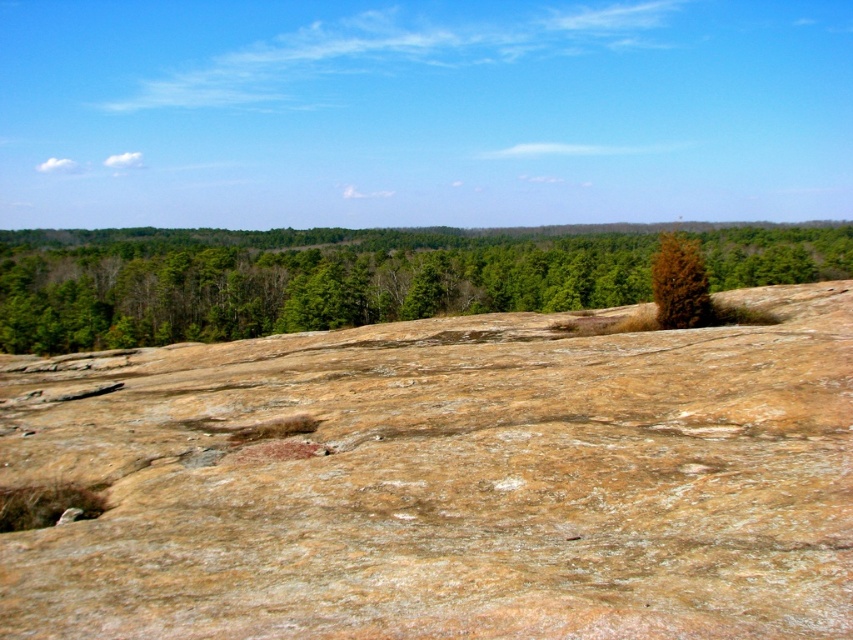
Can you confirm if brown rough rock at center is thinner than green leafy tree at center?

Yes.

Describe the element at coordinates (447, 481) in the screenshot. The height and width of the screenshot is (640, 853). I see `brown rough rock at center` at that location.

Where is `brown rough rock at center`? brown rough rock at center is located at coordinates (447, 481).

Can you confirm if brown rough rock at center is wider than brown textured tree at upper right?

Indeed, brown rough rock at center has a greater width compared to brown textured tree at upper right.

Can you confirm if brown rough rock at center is taller than brown textured tree at upper right?

Yes, brown rough rock at center is taller than brown textured tree at upper right.

Find the location of `brown rough rock at center`. brown rough rock at center is located at coordinates (447, 481).

This screenshot has height=640, width=853. I want to click on brown rough rock at center, so click(x=447, y=481).

Measure the distance from green leafy tree at center to brown textured tree at upper right.

green leafy tree at center and brown textured tree at upper right are 571.91 feet apart from each other.

Is point (265, 301) farther from viewer compared to point (683, 244)?

Yes, point (265, 301) is farther from viewer.

Where is `green leafy tree at center`? The image size is (853, 640). green leafy tree at center is located at coordinates (293, 280).